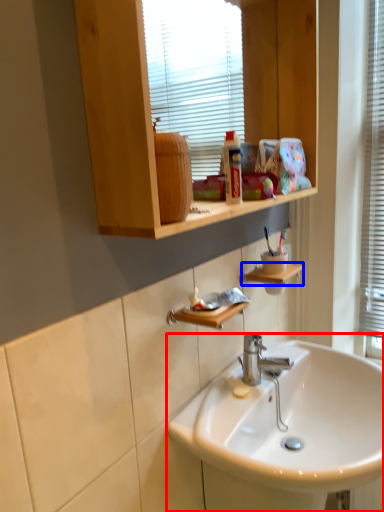
Question: Which of the following is the farthest to the observer, sink (highlighted by a red box) or shelf (highlighted by a blue box)?

Choices:
 (A) sink
 (B) shelf

Answer: (B)